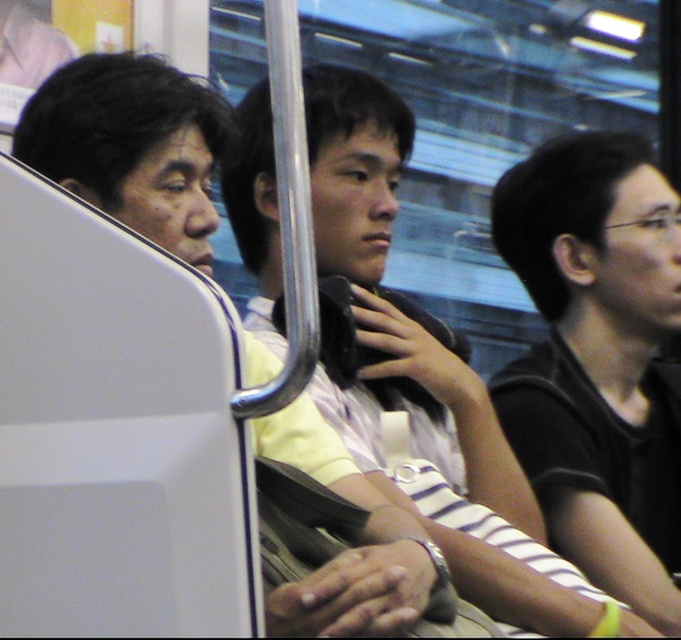
Question: Does black matte shirt at right appear over matte black bag at center?

Choices:
 (A) no
 (B) yes

Answer: (A)

Question: Among these points, which one is nearest to the camera?

Choices:
 (A) (601, 563)
 (B) (347, 140)
 (C) (35, 93)

Answer: (C)

Question: Which of the following is the closest to the observer?

Choices:
 (A) black matte shirt at right
 (B) matte black bag at center
 (C) matte black headphones at center

Answer: (B)

Question: Which object is farther from the camera taking this photo?

Choices:
 (A) matte black headphones at center
 (B) black matte shirt at right

Answer: (B)

Question: Does black matte shirt at right appear on the right side of matte black headphones at center?

Choices:
 (A) no
 (B) yes

Answer: (B)

Question: Can you confirm if black matte shirt at right is positioned to the right of matte black headphones at center?

Choices:
 (A) yes
 (B) no

Answer: (A)